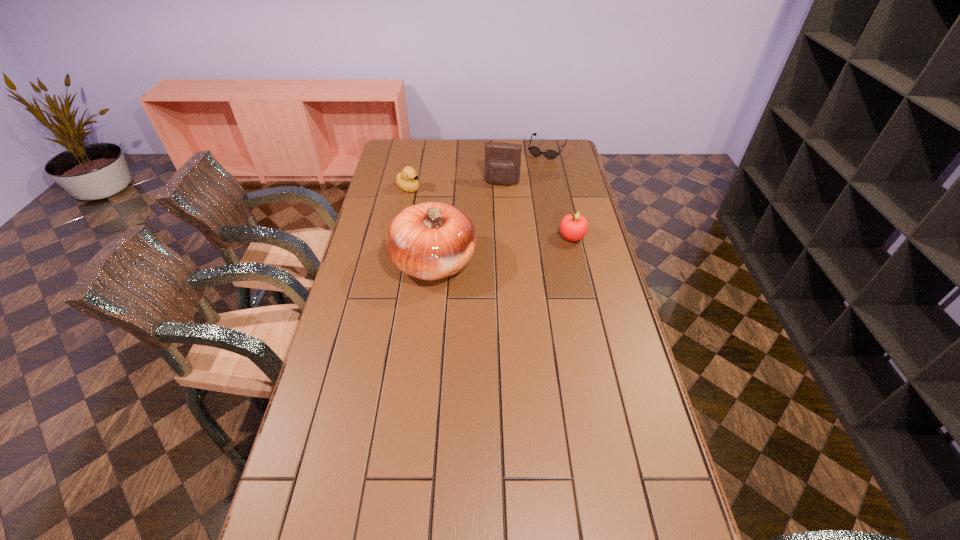
Identify the location of duckling that is at the left edge. The image size is (960, 540). (406, 180).

Locate an element on the screen. apple that is at the right edge is located at coordinates (573, 227).

Locate an element on the screen. sunglasses located at the right edge is located at coordinates (535, 151).

I want to click on object that is at the far right corner, so click(x=535, y=151).

Locate an element on the screen. This screenshot has height=540, width=960. free space at the far edge of the desktop is located at coordinates (448, 141).

Locate an element on the screen. This screenshot has width=960, height=540. free space at the near edge of the desktop is located at coordinates (503, 526).

Identify the location of vacant position at the left edge of the desktop. (335, 368).

Locate an element on the screen. The image size is (960, 540). free space at the right edge of the desktop is located at coordinates (588, 268).

In the image, there is a desktop. At what (x,y) coordinates should I click in order to perform the action: click on free space at the far left corner. Please return your answer as a coordinate pair (x, y). The image size is (960, 540). Looking at the image, I should click on (390, 157).

Find the location of a particular element. The image size is (960, 540). vacant space at the near left corner is located at coordinates (284, 524).